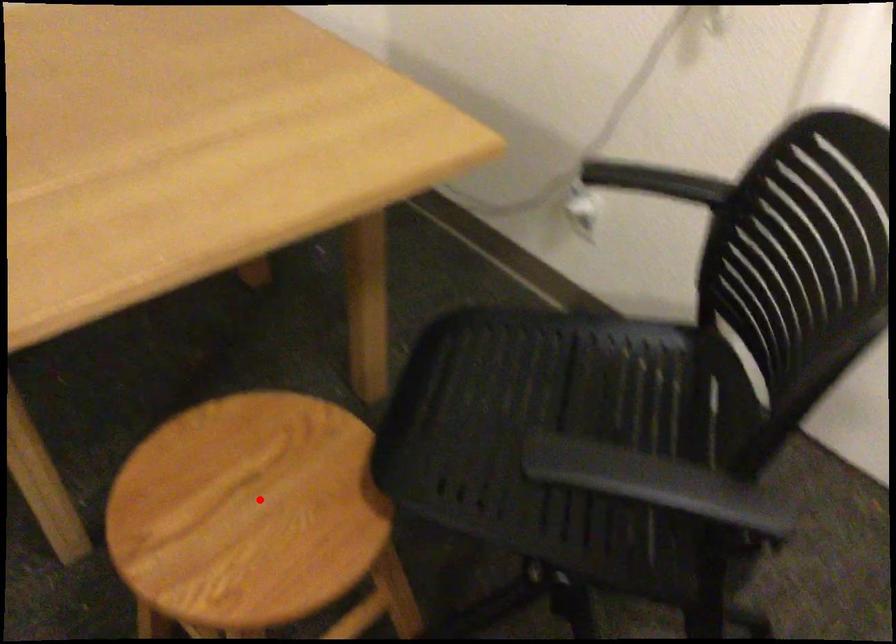
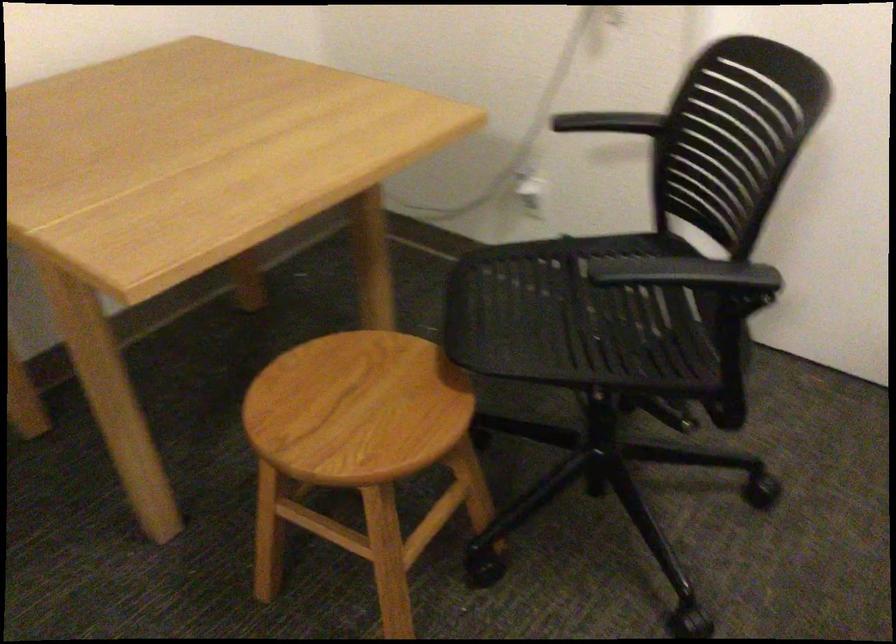
Where in the second image is the point corresponding to the highlighted location from the first image?

(356, 408)